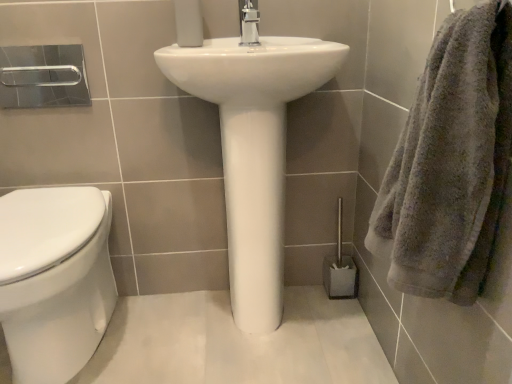
Question: Could you tell me if polished chrome faucet at center is turned towards gray plastic toilet brush at lower right?

Choices:
 (A) yes
 (B) no

Answer: (B)

Question: From a real-world perspective, is polished chrome faucet at center physically below gray plastic toilet brush at lower right?

Choices:
 (A) yes
 (B) no

Answer: (B)

Question: Is polished chrome faucet at center positioned before gray plastic toilet brush at lower right?

Choices:
 (A) no
 (B) yes

Answer: (B)

Question: Is polished chrome faucet at center bigger than gray plastic toilet brush at lower right?

Choices:
 (A) yes
 (B) no

Answer: (B)

Question: Can you confirm if polished chrome faucet at center is wider than gray plastic toilet brush at lower right?

Choices:
 (A) yes
 (B) no

Answer: (A)

Question: Is polished chrome faucet at center at the left side of gray plastic toilet brush at lower right?

Choices:
 (A) yes
 (B) no

Answer: (A)

Question: Does white glossy sink at center touch gray plastic toilet brush at lower right?

Choices:
 (A) yes
 (B) no

Answer: (B)

Question: From a real-world perspective, is white glossy sink at center positioned over gray plastic toilet brush at lower right based on gravity?

Choices:
 (A) no
 (B) yes

Answer: (B)

Question: Is the depth of white glossy sink at center greater than that of gray plastic toilet brush at lower right?

Choices:
 (A) yes
 (B) no

Answer: (B)

Question: Does white glossy sink at center lie in front of gray plastic toilet brush at lower right?

Choices:
 (A) yes
 (B) no

Answer: (A)

Question: Is white glossy sink at center facing towards gray plastic toilet brush at lower right?

Choices:
 (A) no
 (B) yes

Answer: (A)

Question: From the image's perspective, is white glossy sink at center above gray plastic toilet brush at lower right?

Choices:
 (A) yes
 (B) no

Answer: (A)

Question: Is white matte toilet paper at upper center facing away from white glossy toilet at left?

Choices:
 (A) no
 (B) yes

Answer: (A)